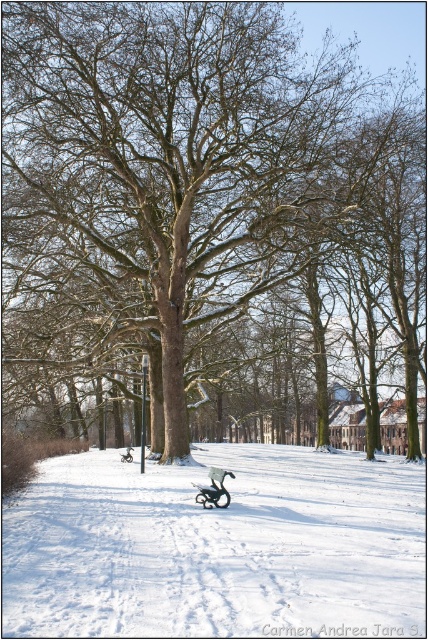
You are a photographer wanting to capture the brown rough tree at center and the white fluffy snow at center in a single frame. Which object will appear larger in the photo?

The brown rough tree at center will appear larger in the photo because it is bigger than the white fluffy snow at center.

Looking at this image, you are planning to build a snowman using the white fluffy snow at center and want to place the metallic silver sleigh at center nearby. Can the sleigh fit next to the snowman without overlapping?

The white fluffy snow at center has a larger width than the metallic silver sleigh at center. Since the snow is wider, there should be enough space to place the sleigh next to the snowman without overlapping.

From the picture: You are standing in the winter park scene and want to reach both points. Which point, point (146, 465) or point (219, 488), will you reach first as you move forward?

You will reach point (146, 465) first because it is closer to you than point (219, 488).